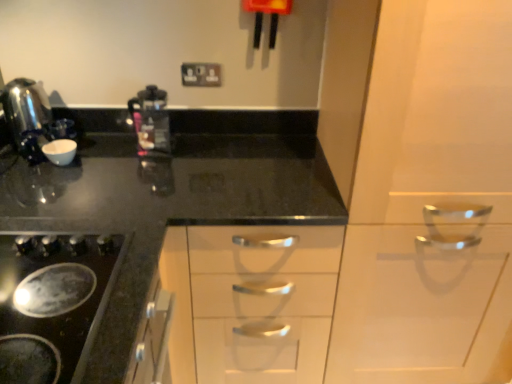
Question: Is point (419, 39) positioned closer to the camera than point (70, 332)?

Choices:
 (A) closer
 (B) farther

Answer: (B)

Question: From a real-world perspective, is white glossy cabinet at center positioned above or below black glass gas stove at lower left?

Choices:
 (A) above
 (B) below

Answer: (B)

Question: Based on their relative distances, which object is farther from the black plastic electric outlet at upper center?

Choices:
 (A) transparent plastic coffee machine at center
 (B) white glossy cabinet at center
 (C) polished stainless steel kettle at left
 (D) black glass gas stove at lower left

Answer: (B)

Question: Which object is positioned closest to the black glass gas stove at lower left?

Choices:
 (A) transparent plastic coffee machine at center
 (B) polished stainless steel kettle at left
 (C) black plastic electric outlet at upper center
 (D) white glossy cabinet at center

Answer: (B)